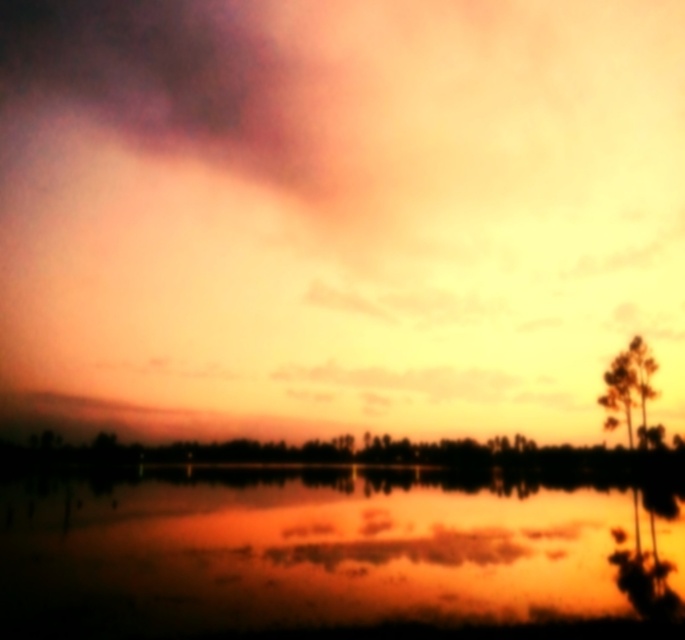
You are standing on the shore of the lake and want to know the distance between the matte orange cloud at upper center and the green matte tree at right. Can you estimate how far apart they are?

The matte orange cloud at upper center and the green matte tree at right are 60.93 meters apart.

You are an artist trying to paint the sunset scene. You want to place the matte orange cloud at upper center in your painting. Where should you position it relative to the reflective water at center?

You should position the matte orange cloud at upper center to the right of the reflective water at center.

From the picture: You are standing at the point marked by point (303, 548) in the image. Looking around, what do you see around you based on the scene description?

You are standing at the point marked by point (303, 548), which is in the reflective water at center. The sky above is painted in warm hues of orange, yellow, and hints of pink and purple, with scattered clouds. The water around you reflects these colors, creating a mirror effect, and silhouettes of trees line the far edge of the water.